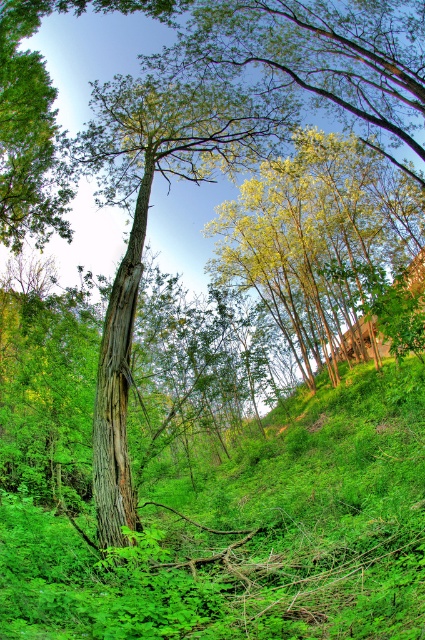
Question: Is green leafy grass at center smaller than brown rough bark tree trunk at center?

Choices:
 (A) no
 (B) yes

Answer: (A)

Question: Which point is closer to the camera?

Choices:
 (A) green leafy grass at center
 (B) green bark tree at center

Answer: (A)

Question: Where is green bark tree at center located in relation to brown rough bark tree trunk at center in the image?

Choices:
 (A) left
 (B) right

Answer: (B)

Question: Which object appears closest to the camera in this image?

Choices:
 (A) brown rough bark tree trunk at center
 (B) green leafy grass at center

Answer: (B)

Question: Is green leafy grass at center smaller than brown rough bark tree trunk at center?

Choices:
 (A) yes
 (B) no

Answer: (B)

Question: Which object is farther from the camera taking this photo?

Choices:
 (A) brown rough bark tree trunk at center
 (B) green leafy grass at center
 (C) green bark tree at center

Answer: (A)